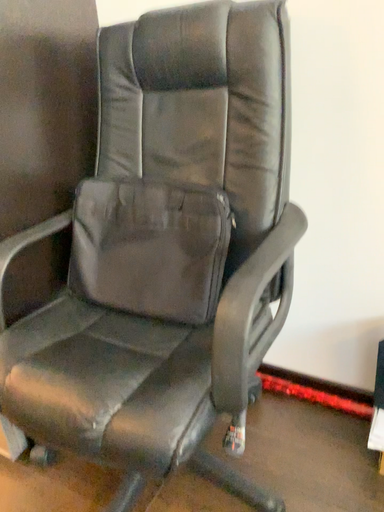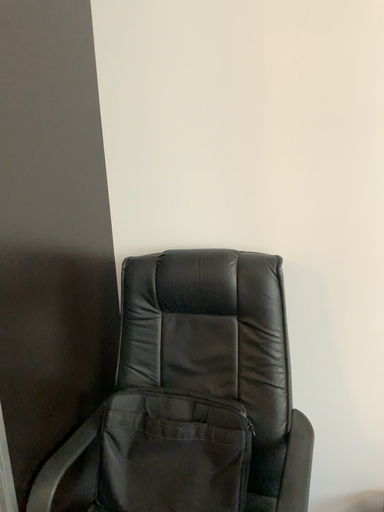
Question: Which way did the camera rotate in the video?

Choices:
 (A) rotated upward
 (B) rotated downward

Answer: (A)